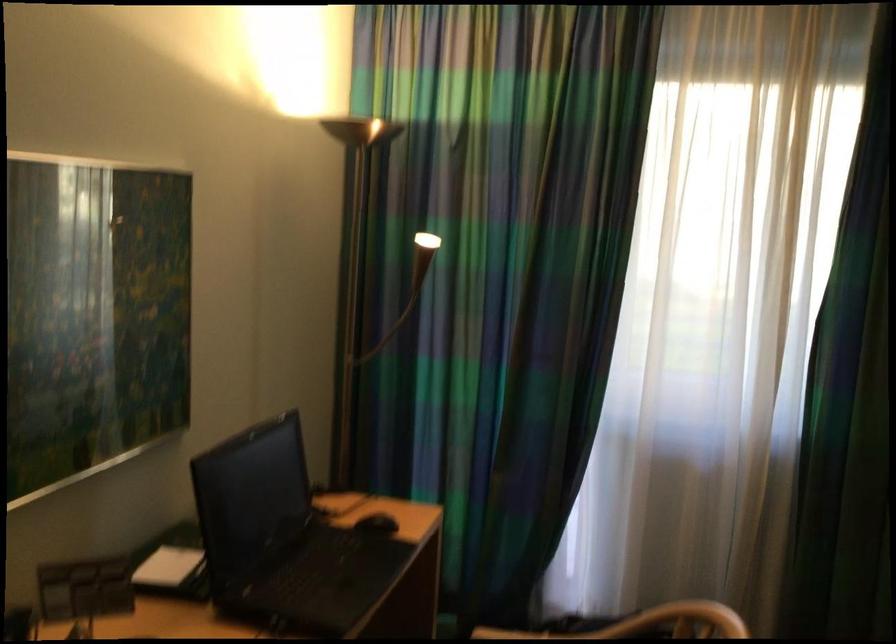
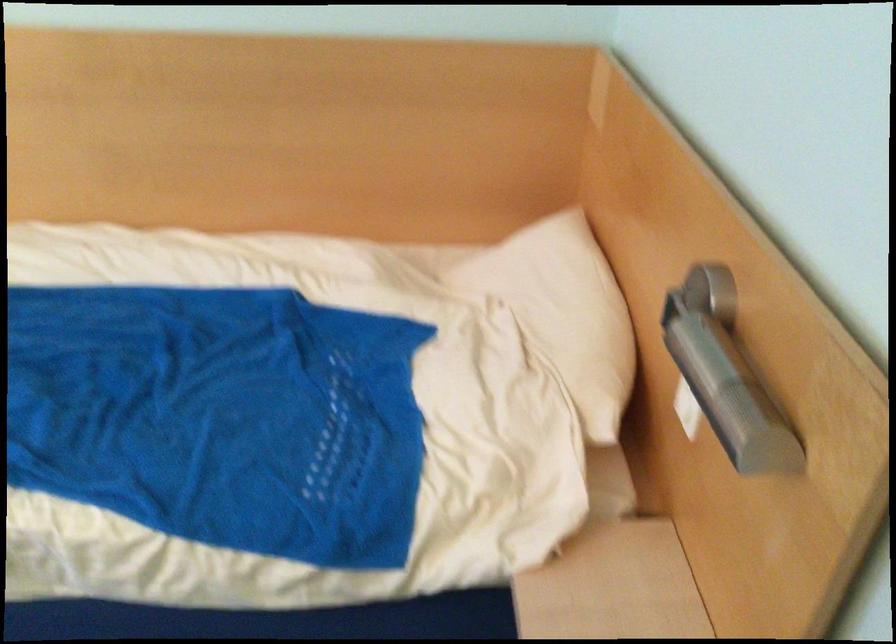
First-person continuous shooting, in which direction is the camera rotating?

The rotation direction of the camera is right-down.